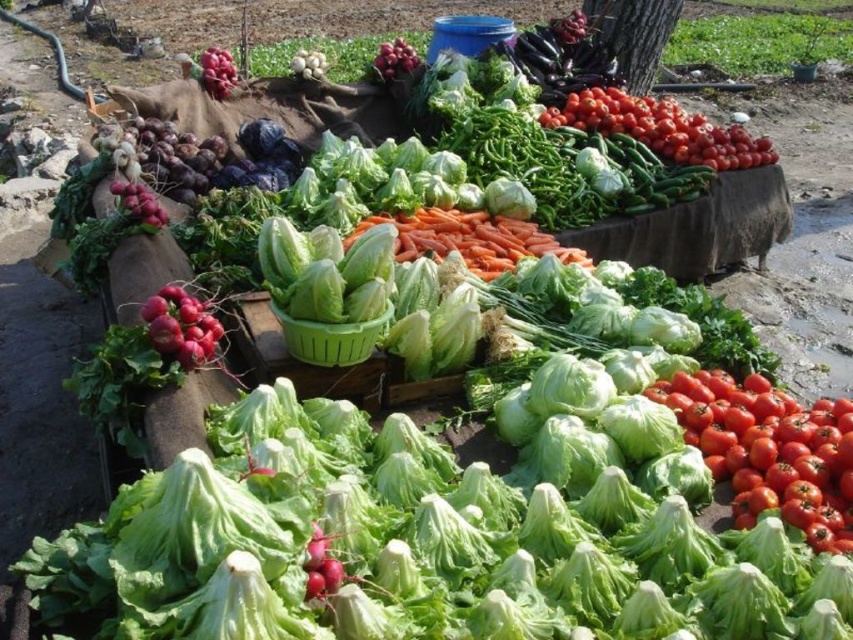
Can you confirm if red matte tomatoes at upper right is positioned below matte red onion at upper center?

Yes.

Which is in front, point (672, 129) or point (397, 44)?

Point (672, 129) is in front.

I want to click on red matte tomatoes at upper right, so click(x=660, y=129).

What do you see at coordinates (769, 451) in the screenshot? I see `red matte tomatoes at lower right` at bounding box center [769, 451].

Who is more forward, (747, 419) or (381, 52)?

Point (747, 419)

The width and height of the screenshot is (853, 640). In order to click on red matte tomatoes at lower right in this screenshot , I will do `click(769, 451)`.

Does point (700, 417) lie in front of point (428, 244)?

Yes, it is in front of point (428, 244).

Measure the distance from red matte tomatoes at lower right to orange smooth carrots at center.

red matte tomatoes at lower right and orange smooth carrots at center are 1.03 meters apart.

Who is more forward, (747, 396) or (421, 253)?

Point (747, 396) is more forward.

The height and width of the screenshot is (640, 853). I want to click on red matte tomatoes at lower right, so click(x=769, y=451).